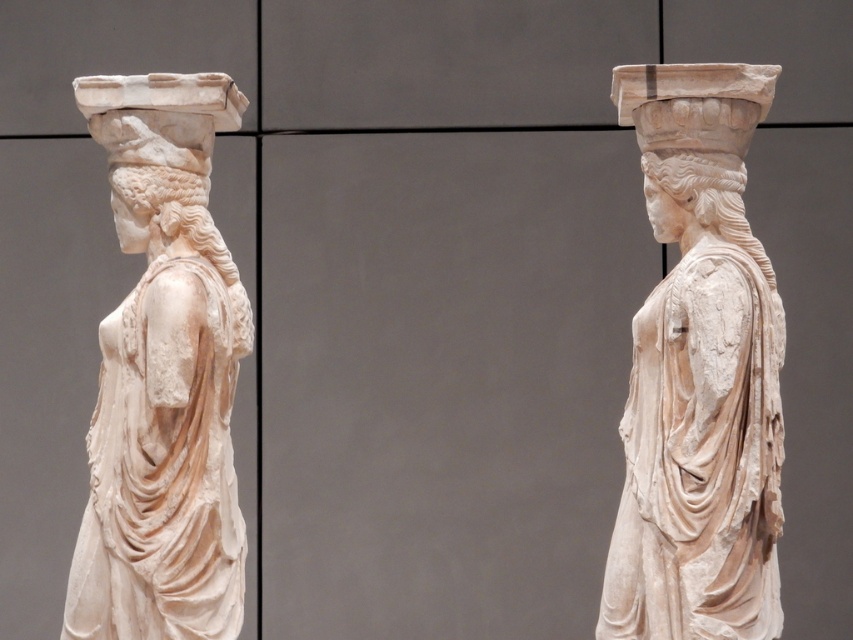
Question: Observing the image, what is the correct spatial positioning of white marble statue at left in reference to white marble head at center?

Choices:
 (A) above
 (B) below

Answer: (B)

Question: Is white marble statue at center to the left of white marble head at center from the viewer's perspective?

Choices:
 (A) no
 (B) yes

Answer: (B)

Question: Which of these objects is positioned closest to the white marble statue at center?

Choices:
 (A) white marble head at center
 (B) white marble head at upper left
 (C) white marble statue at left

Answer: (A)

Question: Which of the following is the closest to the observer?

Choices:
 (A) tap(718, 173)
 (B) tap(178, 195)

Answer: (A)

Question: Does white marble statue at left have a lesser width compared to white marble head at upper left?

Choices:
 (A) yes
 (B) no

Answer: (B)

Question: Among these points, which one is farthest from the camera?

Choices:
 (A) (642, 65)
 (B) (689, 156)
 (C) (93, 600)
 (D) (132, 189)

Answer: (A)